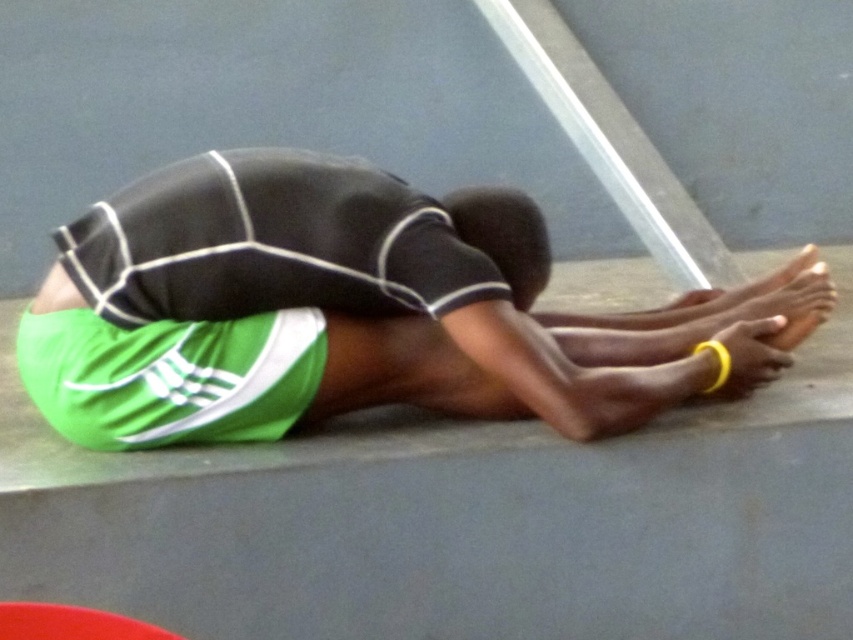
Question: Is green fabric shorts at center below green fabric shorts at lower left?

Choices:
 (A) no
 (B) yes

Answer: (A)

Question: Which of the following is the closest to the observer?

Choices:
 (A) green fabric shorts at lower left
 (B) green fabric shorts at center

Answer: (A)

Question: From the image, what is the correct spatial relationship of green fabric shorts at center in relation to green fabric shorts at lower left?

Choices:
 (A) right
 (B) left

Answer: (A)

Question: Which object appears closest to the camera in this image?

Choices:
 (A) green fabric shorts at center
 (B) green fabric shorts at lower left

Answer: (B)

Question: Is green fabric shorts at center in front of green fabric shorts at lower left?

Choices:
 (A) yes
 (B) no

Answer: (B)